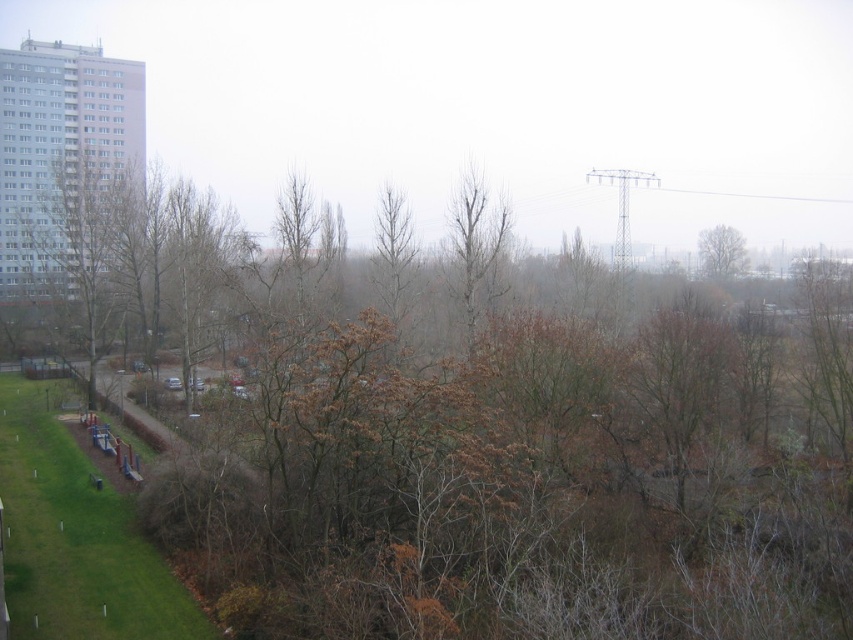
Question: Considering the real-world distances, which object is farthest from the brown leafless tree at left?

Choices:
 (A) bare branches at center
 (B) brown leafless tree at upper right

Answer: (B)

Question: Is bare branches at center positioned at the back of brown leafless tree at upper right?

Choices:
 (A) no
 (B) yes

Answer: (A)

Question: Does bare branches at center have a greater width compared to brown leafless tree at upper right?

Choices:
 (A) no
 (B) yes

Answer: (A)

Question: Does bare branches at center have a smaller size compared to brown leafless tree at upper right?

Choices:
 (A) yes
 (B) no

Answer: (B)

Question: Which is farther from the brown leafless tree at left?

Choices:
 (A) bare branches at center
 (B) brown leafless tree at upper right

Answer: (B)

Question: Based on their relative distances, which object is farther from the brown leafless tree at left?

Choices:
 (A) brown leafless tree at upper right
 (B) bare branches at center

Answer: (A)